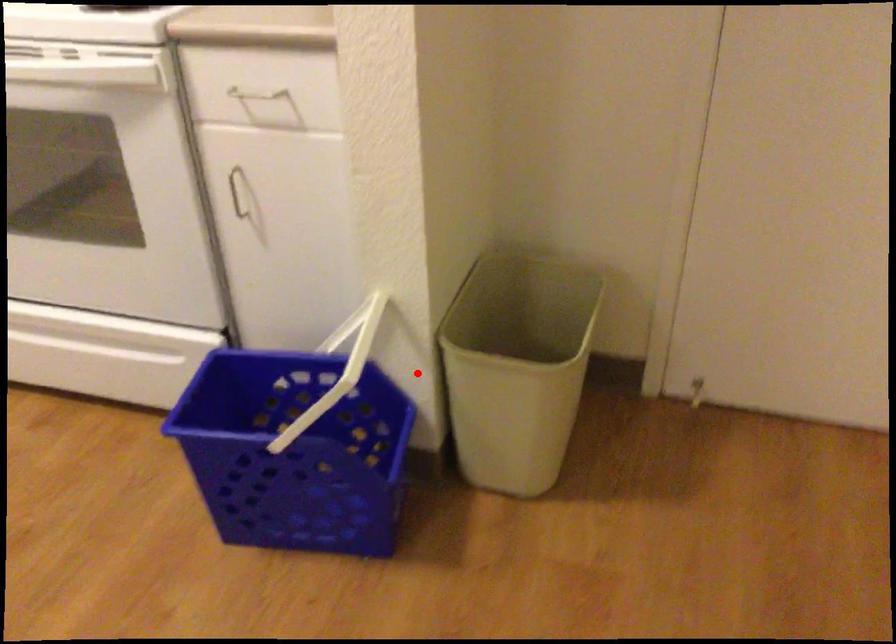
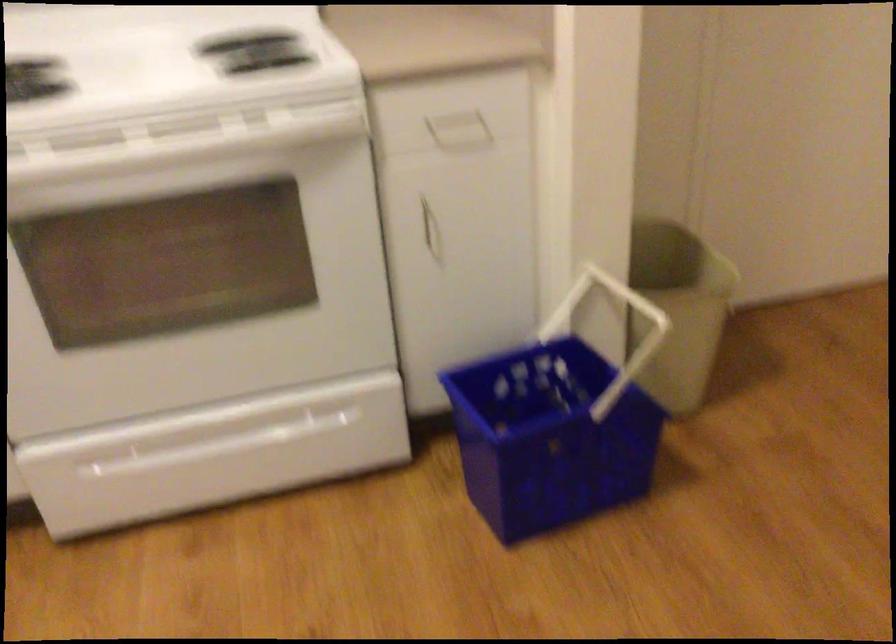
The point at the highlighted location is marked in the first image. Where is the corresponding point in the second image?

(616, 330)